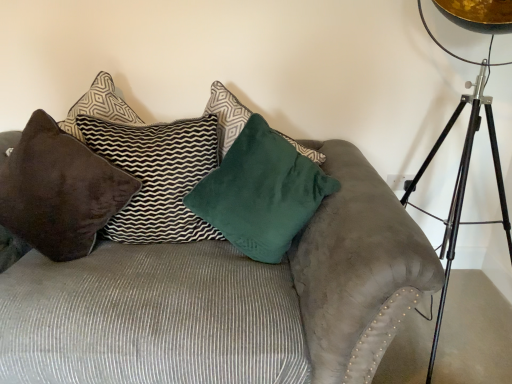
Image resolution: width=512 pixels, height=384 pixels. Find the location of `suede couch at center`. suede couch at center is located at coordinates (199, 281).

Measure the distance from velvet brown pillow at upper left, the second pillow when ordered from right to left, to velvet green pillow at center, which is counted as the 1th pillow, starting from the right.

velvet brown pillow at upper left, the second pillow when ordered from right to left, and velvet green pillow at center, which is counted as the 1th pillow, starting from the right, are 8.21 inches apart.

Who is smaller, velvet brown pillow at upper left, the second pillow when ordered from right to left, or velvet green pillow at center, the 3th pillow positioned from the left?

velvet brown pillow at upper left, the second pillow when ordered from right to left.

Is velvet brown pillow at upper left, the second pillow when ordered from right to left, thinner than velvet green pillow at center, which is counted as the 1th pillow, starting from the right?

Indeed, velvet brown pillow at upper left, the second pillow when ordered from right to left, has a lesser width compared to velvet green pillow at center, which is counted as the 1th pillow, starting from the right.

Is velvet brown pillow at upper left, which ranks as the 2th pillow in left-to-right order, next to velvet green pillow at center, which is counted as the 1th pillow, starting from the right, and touching it?

No, velvet brown pillow at upper left, which ranks as the 2th pillow in left-to-right order, is not touching velvet green pillow at center, which is counted as the 1th pillow, starting from the right.

Is velvet brown pillow at upper left, the second pillow when ordered from right to left, facing towards suede couch at center?

Yes.

What's the angular difference between velvet brown pillow at upper left, which ranks as the 2th pillow in left-to-right order, and suede couch at center's facing directions?

The angle between the facing direction of velvet brown pillow at upper left, which ranks as the 2th pillow in left-to-right order, and the facing direction of suede couch at center is 4.24 degrees.

Which point is more forward, (197, 218) or (398, 298)?

Positioned in front is point (398, 298).

Is velvet brown pillow at left, the first pillow viewed from the left, completely or partially outside of suede couch at center?

Actually, velvet brown pillow at left, the first pillow viewed from the left, is within suede couch at center.

From a real-world perspective, is velvet brown pillow at left, the first pillow viewed from the left, below suede couch at center?

Incorrect, from a real-world perspective, velvet brown pillow at left, the first pillow viewed from the left, is higher than suede couch at center.

Is the surface of velvet brown pillow at left, the first pillow viewed from the left, in direct contact with suede couch at center?

There is a gap between velvet brown pillow at left, the first pillow viewed from the left, and suede couch at center.

How many degrees apart are the facing directions of velvet brown pillow at left, the first pillow viewed from the left, and suede couch at center?

1.53 degrees separate the facing orientations of velvet brown pillow at left, the first pillow viewed from the left, and suede couch at center.

How different are the orientations of suede couch at center and velvet green pillow at center, which is counted as the 1th pillow, starting from the right, in degrees?

10.3 degrees separate the facing orientations of suede couch at center and velvet green pillow at center, which is counted as the 1th pillow, starting from the right.

Who is shorter, suede couch at center or velvet green pillow at center, which is counted as the 1th pillow, starting from the right?

velvet green pillow at center, which is counted as the 1th pillow, starting from the right.

How much distance is there between suede couch at center and velvet green pillow at center, the 3th pillow positioned from the left?

suede couch at center is 9.91 inches from velvet green pillow at center, the 3th pillow positioned from the left.

Is suede couch at center not inside velvet green pillow at center, which is counted as the 1th pillow, starting from the right?

That's correct, suede couch at center is outside of velvet green pillow at center, which is counted as the 1th pillow, starting from the right.

At what (x,y) coordinates should I click in order to perform the action: click on the 2nd pillow above the velvet green pillow at center, which is counted as the 1th pillow, starting from the right (from the image's perspective). Please return your answer as a coordinate pair (x, y). The image size is (512, 384). Looking at the image, I should click on (157, 176).

Does velvet green pillow at center, which is counted as the 1th pillow, starting from the right, have a greater width compared to velvet brown pillow at upper left, which ranks as the 2th pillow in left-to-right order?

Correct, the width of velvet green pillow at center, which is counted as the 1th pillow, starting from the right, exceeds that of velvet brown pillow at upper left, which ranks as the 2th pillow in left-to-right order.

Is velvet brown pillow at upper left, the second pillow when ordered from right to left, at the back of velvet green pillow at center, the 3th pillow positioned from the left?

No.

From a real-world perspective, which is physically above, velvet green pillow at center, which is counted as the 1th pillow, starting from the right, or velvet brown pillow at upper left, the second pillow when ordered from right to left?

From a 3D spatial view, velvet green pillow at center, which is counted as the 1th pillow, starting from the right, is above.

Based on the photo, is velvet green pillow at center, the 3th pillow positioned from the left, next to velvet brown pillow at left, the first pillow viewed from the left?

No, velvet green pillow at center, the 3th pillow positioned from the left, is not with velvet brown pillow at left, the first pillow viewed from the left.

Is velvet green pillow at center, which is counted as the 1th pillow, starting from the right, positioned before velvet brown pillow at left, which is the 3th pillow in right-to-left order?

Yes, velvet green pillow at center, which is counted as the 1th pillow, starting from the right, is closer to the camera.

Could you measure the distance between velvet green pillow at center, which is counted as the 1th pillow, starting from the right, and velvet brown pillow at left, the first pillow viewed from the left?

velvet green pillow at center, which is counted as the 1th pillow, starting from the right, and velvet brown pillow at left, the first pillow viewed from the left, are 17.15 inches apart from each other.

How different are the orientations of velvet green pillow at center, the 3th pillow positioned from the left, and velvet brown pillow at left, which is the 3th pillow in right-to-left order, in degrees?

8.76 degrees.

How distant is velvet brown pillow at left, the first pillow viewed from the left, from velvet brown pillow at upper left, the second pillow when ordered from right to left?

velvet brown pillow at left, the first pillow viewed from the left, and velvet brown pillow at upper left, the second pillow when ordered from right to left, are 6.08 inches apart from each other.

From a real-world perspective, which object rests below the other?

From a 3D spatial view, velvet brown pillow at left, which is the 3th pillow in right-to-left order, is below.

Considering the sizes of velvet brown pillow at left, which is the 3th pillow in right-to-left order, and velvet brown pillow at upper left, which ranks as the 2th pillow in left-to-right order, in the image, is velvet brown pillow at left, which is the 3th pillow in right-to-left order, bigger or smaller than velvet brown pillow at upper left, which ranks as the 2th pillow in left-to-right order,?

In the image, velvet brown pillow at left, which is the 3th pillow in right-to-left order, appears to be larger than velvet brown pillow at upper left, which ranks as the 2th pillow in left-to-right order.

Is velvet brown pillow at left, which is the 3th pillow in right-to-left order, situated inside velvet brown pillow at upper left, which ranks as the 2th pillow in left-to-right order, or outside?

velvet brown pillow at left, which is the 3th pillow in right-to-left order, exists outside the volume of velvet brown pillow at upper left, which ranks as the 2th pillow in left-to-right order.

From a real-world perspective, starting from the velvet green pillow at center, which is counted as the 1th pillow, starting from the right, which pillow is the 1st one below it? Please provide its 2D coordinates.

[(157, 176)]

Identify the location of pillow that is the 3rd one when counting upward from the suede couch at center (from the image's perspective). (157, 176).

Looking at the image, which one is located closer to velvet green pillow at center, the 3th pillow positioned from the left, suede couch at center or velvet brown pillow at upper left, which ranks as the 2th pillow in left-to-right order?

velvet brown pillow at upper left, which ranks as the 2th pillow in left-to-right order.

From the image, which object appears to be farther from velvet brown pillow at left, the first pillow viewed from the left, velvet brown pillow at upper left, which ranks as the 2th pillow in left-to-right order, or suede couch at center?

The object further to velvet brown pillow at left, the first pillow viewed from the left, is suede couch at center.

Based on their spatial positions, is velvet brown pillow at left, the first pillow viewed from the left, or velvet green pillow at center, which is counted as the 1th pillow, starting from the right, closer to velvet brown pillow at upper left, which ranks as the 2th pillow in left-to-right order?

velvet brown pillow at left, the first pillow viewed from the left, is positioned closer to the anchor velvet brown pillow at upper left, which ranks as the 2th pillow in left-to-right order.

From the image, which object appears to be nearer to suede couch at center, velvet brown pillow at left, the first pillow viewed from the left, or velvet brown pillow at upper left, the second pillow when ordered from right to left?

velvet brown pillow at left, the first pillow viewed from the left, is closer to suede couch at center.

Looking at the image, which one is located closer to velvet brown pillow at upper left, which ranks as the 2th pillow in left-to-right order, velvet brown pillow at left, the first pillow viewed from the left, or suede couch at center?

Among the two, velvet brown pillow at left, the first pillow viewed from the left, is located nearer to velvet brown pillow at upper left, which ranks as the 2th pillow in left-to-right order.

Which object lies nearer to the anchor point suede couch at center, velvet green pillow at center, which is counted as the 1th pillow, starting from the right, or velvet brown pillow at left, which is the 3th pillow in right-to-left order?

Based on the image, velvet brown pillow at left, which is the 3th pillow in right-to-left order, appears to be nearer to suede couch at center.

Estimate the real-world distances between objects in this image. Which object is further from velvet brown pillow at upper left, the second pillow when ordered from right to left, suede couch at center or velvet brown pillow at left, the first pillow viewed from the left?

Based on the image, suede couch at center appears to be further to velvet brown pillow at upper left, the second pillow when ordered from right to left.

In the scene shown: From the image, which object appears to be nearer to velvet green pillow at center, which is counted as the 1th pillow, starting from the right, velvet brown pillow at upper left, the second pillow when ordered from right to left, or suede couch at center?

velvet brown pillow at upper left, the second pillow when ordered from right to left, lies closer to velvet green pillow at center, which is counted as the 1th pillow, starting from the right, than the other object.

Find the location of a particular element. studio couch between velvet brown pillow at upper left, which ranks as the 2th pillow in left-to-right order, and velvet green pillow at center, which is counted as the 1th pillow, starting from the right is located at coordinates (199, 281).

Where is `pillow between velvet brown pillow at left, the first pillow viewed from the left, and velvet green pillow at center, the 3th pillow positioned from the left`? The image size is (512, 384). pillow between velvet brown pillow at left, the first pillow viewed from the left, and velvet green pillow at center, the 3th pillow positioned from the left is located at coordinates (157, 176).

Image resolution: width=512 pixels, height=384 pixels. What are the coordinates of `studio couch between velvet brown pillow at left, the first pillow viewed from the left, and velvet green pillow at center, which is counted as the 1th pillow, starting from the right, in the horizontal direction` in the screenshot? It's located at (199, 281).